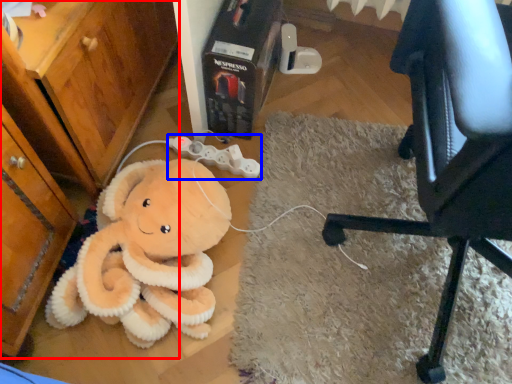
Question: Which of the following is the closest to the observer, dresser (highlighted by a red box) or game controller (highlighted by a blue box)?

Choices:
 (A) dresser
 (B) game controller

Answer: (A)